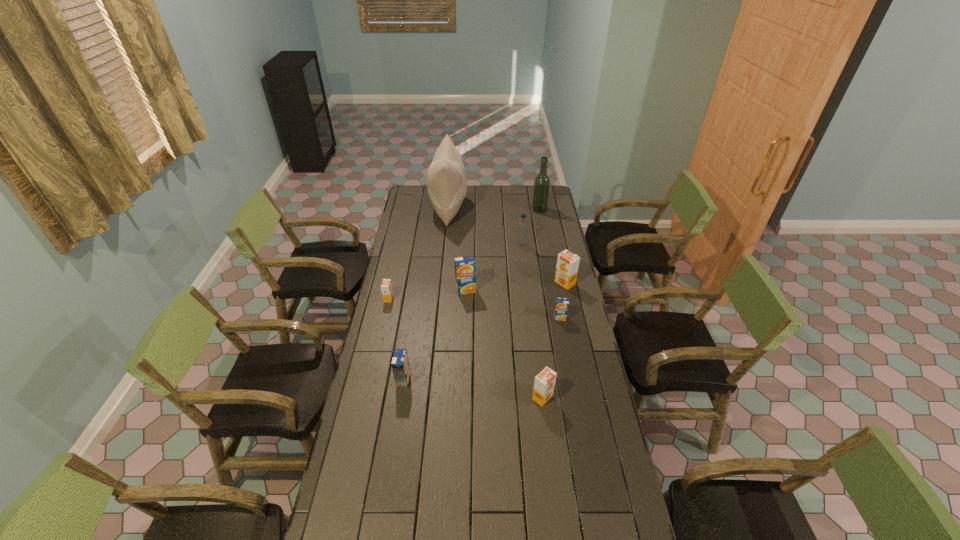
The image size is (960, 540). What are the coordinates of `vacant space at the left edge` in the screenshot? It's located at click(375, 322).

Find the location of a particular element. free space at the right edge is located at coordinates (602, 536).

This screenshot has height=540, width=960. I want to click on vacant region at the far left corner, so click(417, 188).

This screenshot has height=540, width=960. I want to click on vacant area that lies between the farthest blue orange_juice and the leftmost orange_juice, so click(427, 294).

The height and width of the screenshot is (540, 960). In order to click on free area in between the second nearest object and the fourth orange_juice from right to left in this screenshot , I will do `click(435, 335)`.

This screenshot has width=960, height=540. What are the coordinates of `free area in between the fifth farthest orange_juice and the nearest orange orange juice` in the screenshot? It's located at (473, 389).

Identify the location of free space between the biggest blue orange_juice and the leftmost object. This screenshot has width=960, height=540. (427, 294).

Find the location of a particular element. free space between the cushion and the biggest orange orange juice is located at coordinates (507, 246).

Identify the location of vacant area that lies between the second smallest orange orange juice and the farthest blue orange_juice. (504, 343).

The image size is (960, 540). I want to click on free space between the liquor and the farthest orange orange juice, so 552,246.